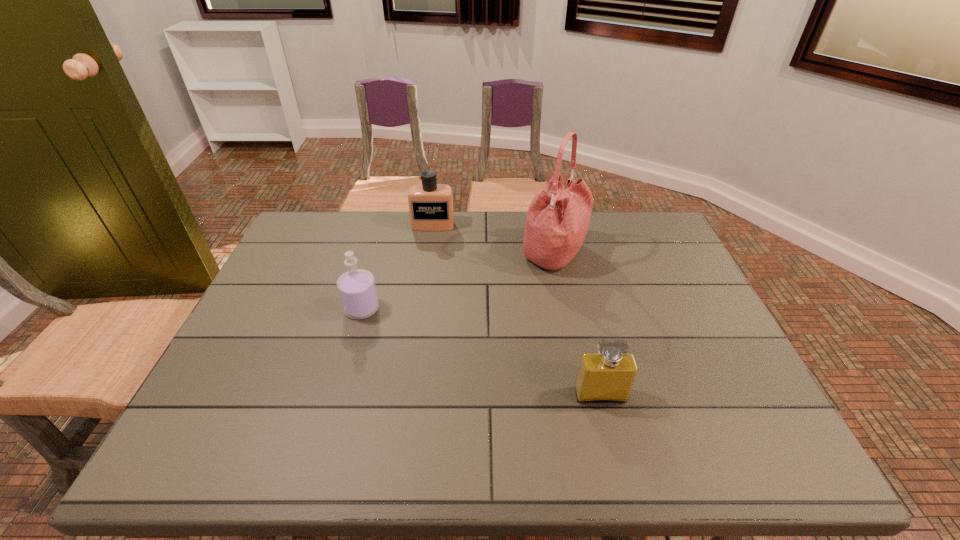
The height and width of the screenshot is (540, 960). Identify the location of the tallest object. (557, 221).

Identify the location of the third nearest object. The width and height of the screenshot is (960, 540). (557, 221).

Identify the location of the second object from left to right. This screenshot has height=540, width=960. (430, 204).

Identify the location of the farthest object. The image size is (960, 540). (430, 204).

Locate an element on the screen. This screenshot has height=540, width=960. the leftmost perfume is located at coordinates (357, 290).

Find the location of a particular element. The image size is (960, 540). the leftmost object is located at coordinates (x=357, y=290).

Locate an element on the screen. The height and width of the screenshot is (540, 960). the nearest object is located at coordinates (608, 376).

You are a GUI agent. You are given a task and a screenshot of the screen. Output one action in this format:
    pyautogui.click(x=<x>, y=<y>)
    Task: Click on the nearest perfume
    
    Given the screenshot: What is the action you would take?
    pyautogui.click(x=608, y=376)

I want to click on vacant space located on the left of the third nearest object, so click(394, 254).

Find the location of a particular element. Image resolution: width=960 pixels, height=540 pixels. vacant space located 0.320m on the front label of the farthest object is located at coordinates (422, 298).